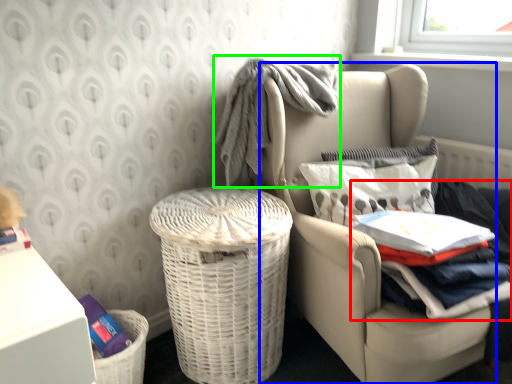
Question: Which is nearer to the clothing (highlighted by a red box)? chair (highlighted by a blue box) or baby clothe (highlighted by a green box).

Choices:
 (A) chair
 (B) baby clothe

Answer: (A)